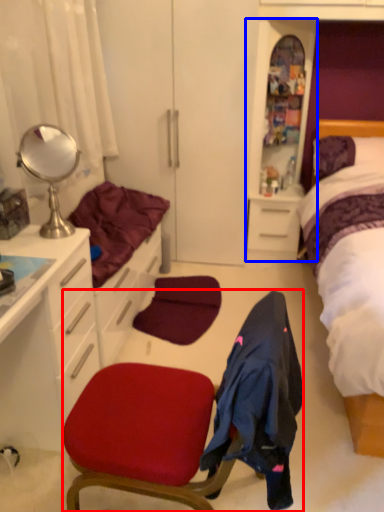
Question: Which object appears closest to the camera in this image, chair (highlighted by a red box) or file cabinet (highlighted by a blue box)?

Choices:
 (A) chair
 (B) file cabinet

Answer: (A)